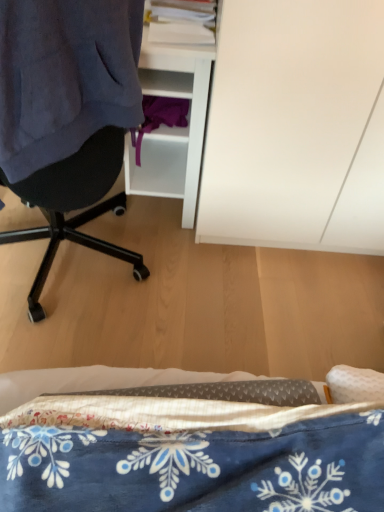
This screenshot has height=512, width=384. In order to click on blank space situated above blue printed fabric at lower center (from a real-world perspective) in this screenshot , I will do `click(184, 437)`.